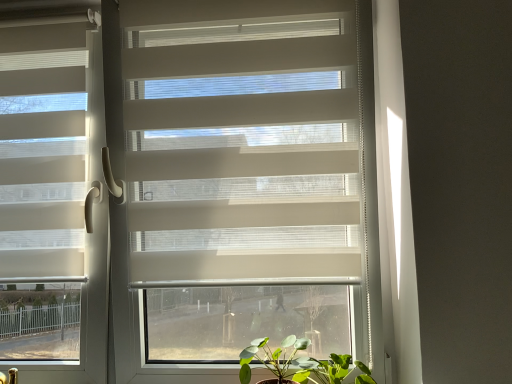
Consider the image. What is the approximate height of green matte plant at lower center?

The height of green matte plant at lower center is 18.05 centimeters.

In order to click on matte white blinds at left in this screenshot , I will do `click(52, 200)`.

Considering the relative positions of green leafy plant at lower center and green matte plant at lower center in the image provided, is green leafy plant at lower center to the left or to the right of green matte plant at lower center?

Clearly, green leafy plant at lower center is on the right of green matte plant at lower center in the image.

Which object is more forward, green leafy plant at lower center or green matte plant at lower center?

green leafy plant at lower center.

Is green leafy plant at lower center placed right next to green matte plant at lower center?

Yes, green leafy plant at lower center is in contact with green matte plant at lower center.

Does point (282, 360) come farther from viewer compared to point (19, 202)?

That is False.

Can you confirm if green matte plant at lower center is positioned to the left of matte white blinds at left?

Incorrect, green matte plant at lower center is not on the left side of matte white blinds at left.

Considering the sizes of objects green matte plant at lower center and matte white blinds at left in the image provided, who is bigger, green matte plant at lower center or matte white blinds at left?

Bigger between the two is matte white blinds at left.

From the image's perspective, is green matte plant at lower center above or below matte white blinds at left?

green matte plant at lower center is below matte white blinds at left.

How different are the orientations of matte white blinds at left and green matte plant at lower center in degrees?

matte white blinds at left and green matte plant at lower center are facing 2.89 degrees away from each other.

Is matte white blinds at left at the left side of green matte plant at lower center?

Correct, you'll find matte white blinds at left to the left of green matte plant at lower center.

Is matte white blinds at left oriented away from green matte plant at lower center?

matte white blinds at left is not turned away from green matte plant at lower center.

Is matte white blinds at left situated inside green matte plant at lower center or outside?

matte white blinds at left is outside green matte plant at lower center.

Considering the sizes of green leafy plant at lower center and matte white blinds at left in the image, is green leafy plant at lower center taller or shorter than matte white blinds at left?

Considering their sizes, green leafy plant at lower center has less height than matte white blinds at left.

Could you tell me if green leafy plant at lower center is turned towards matte white blinds at left?

No, green leafy plant at lower center is not aimed at matte white blinds at left.

Locate an element on the screen. The image size is (512, 384). window blind above the green leafy plant at lower center (from the image's perspective) is located at coordinates (52, 200).

Would you consider green leafy plant at lower center to be distant from matte white blinds at left?

No, green leafy plant at lower center is in close proximity to matte white blinds at left.

In terms of height, does matte white blinds at left look taller or shorter compared to green leafy plant at lower center?

matte white blinds at left is taller than green leafy plant at lower center.

Is matte white blinds at left far from green leafy plant at lower center?

No, matte white blinds at left is not far away from green leafy plant at lower center.

Which of these two, matte white blinds at left or green leafy plant at lower center, is smaller?

With smaller size is green leafy plant at lower center.

From a real-world perspective, which is physically above, green matte plant at lower center or green leafy plant at lower center?

In real-world perspective, green matte plant at lower center is above.

Could you tell me if green matte plant at lower center is facing green leafy plant at lower center?

No, green matte plant at lower center is not oriented towards green leafy plant at lower center.

Is green leafy plant at lower center a part of green matte plant at lower center?

No, green matte plant at lower center does not contain green leafy plant at lower center.

Where is `vegetation below the green matte plant at lower center (from a real-world perspective)`? The width and height of the screenshot is (512, 384). vegetation below the green matte plant at lower center (from a real-world perspective) is located at coordinates click(326, 370).

Locate an element on the screen. vegetation that is on the right side of green matte plant at lower center is located at coordinates (326, 370).

Where is `window blind above the green matte plant at lower center (from a real-world perspective)`? Image resolution: width=512 pixels, height=384 pixels. window blind above the green matte plant at lower center (from a real-world perspective) is located at coordinates (52, 200).

From the picture: Considering their positions, is green matte plant at lower center positioned further to matte white blinds at left than green leafy plant at lower center?

green leafy plant at lower center lies further to matte white blinds at left than the other object.

Estimate the real-world distances between objects in this image. Which object is closer to green leafy plant at lower center, matte white blinds at left or green matte plant at lower center?

green matte plant at lower center lies closer to green leafy plant at lower center than the other object.

Which object lies nearer to the anchor point matte white blinds at left, green leafy plant at lower center or green matte plant at lower center?

The object closer to matte white blinds at left is green matte plant at lower center.

Looking at the image, which one is located closer to green matte plant at lower center, matte white blinds at left or green leafy plant at lower center?

Among the two, green leafy plant at lower center is located nearer to green matte plant at lower center.

Considering their positions, is green matte plant at lower center positioned further to green leafy plant at lower center than matte white blinds at left?

matte white blinds at left is further to green leafy plant at lower center.

Which object lies further to the anchor point green matte plant at lower center, green leafy plant at lower center or matte white blinds at left?

matte white blinds at left.

Locate an element on the screen. The image size is (512, 384). houseplant located between matte white blinds at left and green leafy plant at lower center in the left-right direction is located at coordinates (294, 363).